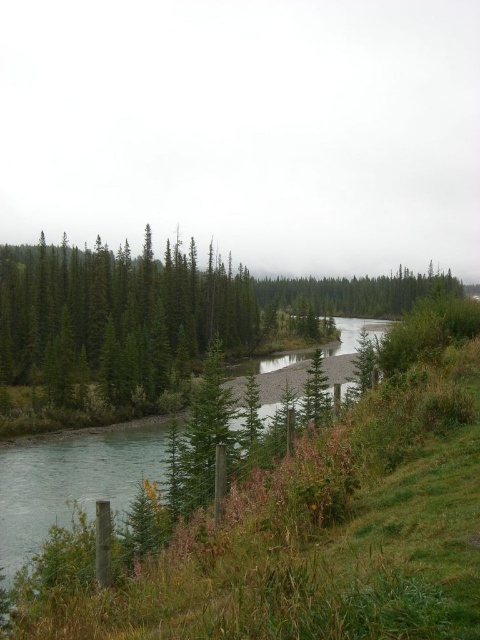
You are planning to build a small wooden dock for fishing. Based on the scene, which object between the green smooth river at center and the green matte trees at center would you choose to place the dock near, and why?

The green smooth river at center has a smaller size compared to the green matte trees at center, so the dock should be placed near the river since it is the appropriate location for fishing activities.

You are standing at the edge of the river in the serene landscape. You see two points marked in the image. Which point, point (x=69, y=344) or point (x=335, y=312), is closer to you?

Point (x=69, y=344) is closer to you because it is in front of point (x=335, y=312).